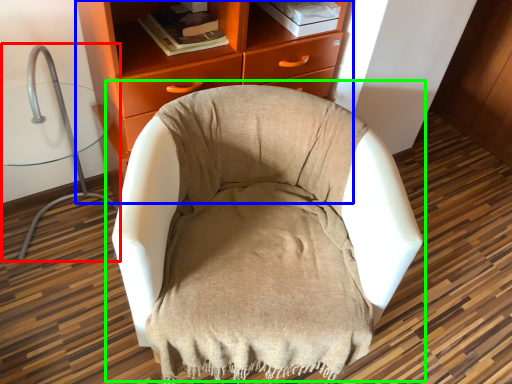
Question: Based on their relative distances, which object is farther from computer chair (highlighted by a red box)? Choose from chest of drawers (highlighted by a blue box) and chair (highlighted by a green box).

Choices:
 (A) chest of drawers
 (B) chair

Answer: (B)